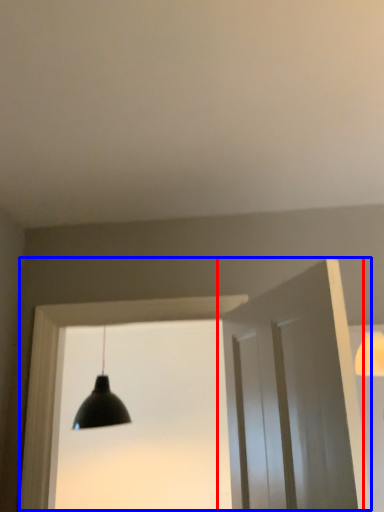
Question: Which object is further to the camera taking this photo, door (highlighted by a red box) or window frame (highlighted by a blue box)?

Choices:
 (A) door
 (B) window frame

Answer: (B)